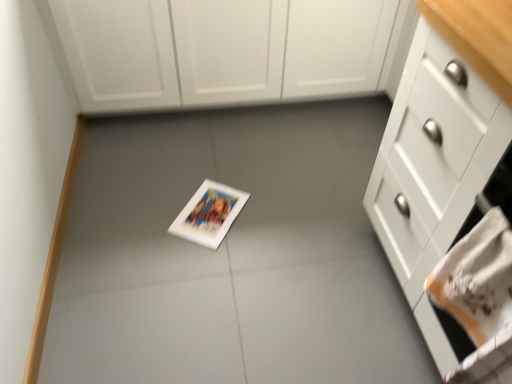
Question: Can you confirm if white embroidered hand towel at lower right is bigger than white matte cabinet at upper center, marked as the second cabinetry in a bottom-to-top arrangement?

Choices:
 (A) yes
 (B) no

Answer: (B)

Question: Is white embroidered hand towel at lower right not close to white matte cabinet at upper center, acting as the first cabinetry starting from the top?

Choices:
 (A) yes
 (B) no

Answer: (A)

Question: Could you tell me if white embroidered hand towel at lower right is turned towards white matte cabinet at upper center, acting as the first cabinetry starting from the top?

Choices:
 (A) no
 (B) yes

Answer: (A)

Question: From the image's perspective, is white embroidered hand towel at lower right over white matte cabinet at upper center, acting as the first cabinetry starting from the top?

Choices:
 (A) yes
 (B) no

Answer: (B)

Question: Is white embroidered hand towel at lower right thinner than white matte cabinet at upper center, the first cabinetry from the back?

Choices:
 (A) yes
 (B) no

Answer: (A)

Question: From their relative heights in the image, would you say white matte cabinet at upper center, placed as the second cabinetry when sorted from front to back, is taller or shorter than white embroidered hand towel at lower right?

Choices:
 (A) short
 (B) tall

Answer: (B)

Question: In terms of size, does white matte cabinet at upper center, the first cabinetry from the back, appear bigger or smaller than white embroidered hand towel at lower right?

Choices:
 (A) big
 (B) small

Answer: (A)

Question: Considering the positions of white matte cabinet at upper center, the first cabinetry from the back, and white embroidered hand towel at lower right in the image, is white matte cabinet at upper center, the first cabinetry from the back, wider or thinner than white embroidered hand towel at lower right?

Choices:
 (A) thin
 (B) wide

Answer: (B)

Question: From the image's perspective, is white matte cabinet at upper center, the first cabinetry from the back, above or below white embroidered hand towel at lower right?

Choices:
 (A) below
 (B) above

Answer: (B)

Question: Considering the positions of point (431, 97) and point (466, 365), is point (431, 97) closer or farther from the camera than point (466, 365)?

Choices:
 (A) farther
 (B) closer

Answer: (A)

Question: From the image's perspective, is white glossy cabinet at right, the second cabinetry in the top-to-bottom sequence, positioned above or below white embroidered hand towel at lower right?

Choices:
 (A) above
 (B) below

Answer: (A)

Question: Visually, is white glossy cabinet at right, the 2th cabinetry in the back-to-front sequence, positioned to the left or to the right of white embroidered hand towel at lower right?

Choices:
 (A) right
 (B) left

Answer: (A)

Question: Is white glossy cabinet at right, the 2th cabinetry in the back-to-front sequence, in front of or behind white embroidered hand towel at lower right in the image?

Choices:
 (A) behind
 (B) front

Answer: (B)

Question: Is white glossy cabinet at right, the second cabinetry in the top-to-bottom sequence, inside or outside of white matte cabinet at upper center, the first cabinetry from the back?

Choices:
 (A) inside
 (B) outside

Answer: (B)

Question: Does point (501, 109) appear closer or farther from the camera than point (249, 61)?

Choices:
 (A) farther
 (B) closer

Answer: (B)